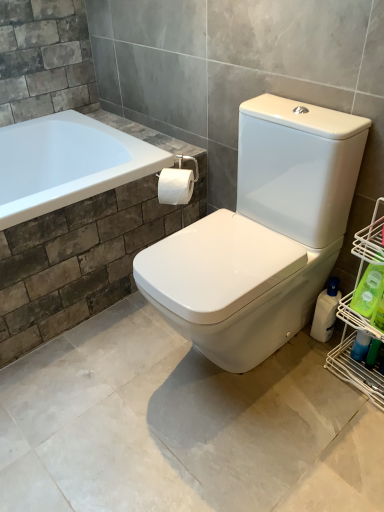
Question: Is blue glossy spray bottle at lower right, which is the second cleaning product from back to front, shorter than white matte toilet paper at center?

Choices:
 (A) yes
 (B) no

Answer: (B)

Question: From a real-world perspective, is blue glossy spray bottle at lower right, the second cleaning product in the front-to-back sequence, over white matte toilet paper at center?

Choices:
 (A) no
 (B) yes

Answer: (A)

Question: Is blue glossy spray bottle at lower right, which is the second cleaning product from back to front, touching white matte toilet paper at center?

Choices:
 (A) no
 (B) yes

Answer: (A)

Question: Does blue glossy spray bottle at lower right, the second cleaning product in the front-to-back sequence, lie in front of white matte toilet paper at center?

Choices:
 (A) yes
 (B) no

Answer: (A)

Question: Is blue glossy spray bottle at lower right, which is the second cleaning product from back to front, at the left side of white matte toilet paper at center?

Choices:
 (A) yes
 (B) no

Answer: (B)

Question: From their relative heights in the image, would you say green plastic bottle at lower right, which is counted as the third cleaning product, starting from the back, is taller or shorter than white matte toilet paper at center?

Choices:
 (A) short
 (B) tall

Answer: (B)

Question: From the image's perspective, is green plastic bottle at lower right, acting as the first cleaning product starting from the front, positioned above or below white matte toilet paper at center?

Choices:
 (A) above
 (B) below

Answer: (B)

Question: Based on their positions, is green plastic bottle at lower right, acting as the first cleaning product starting from the front, located to the left or right of white matte toilet paper at center?

Choices:
 (A) right
 (B) left

Answer: (A)

Question: Considering the positions of green plastic bottle at lower right, acting as the first cleaning product starting from the front, and white matte toilet paper at center in the image, is green plastic bottle at lower right, acting as the first cleaning product starting from the front, wider or thinner than white matte toilet paper at center?

Choices:
 (A) thin
 (B) wide

Answer: (A)

Question: Is point (167, 187) closer or farther from the camera than point (367, 271)?

Choices:
 (A) closer
 (B) farther

Answer: (B)

Question: In the image, is white matte toilet paper at center positioned in front of or behind green plastic bottle at lower right, acting as the first cleaning product starting from the front?

Choices:
 (A) behind
 (B) front

Answer: (A)

Question: Is white matte toilet paper at center inside or outside of green plastic bottle at lower right, which is counted as the third cleaning product, starting from the back?

Choices:
 (A) inside
 (B) outside

Answer: (B)

Question: Would you say white matte toilet paper at center is to the left or to the right of green plastic bottle at lower right, which is counted as the third cleaning product, starting from the back, in the picture?

Choices:
 (A) left
 (B) right

Answer: (A)

Question: In terms of width, does green plastic bottle at lower right, acting as the first cleaning product starting from the front, look wider or thinner when compared to blue glossy spray bottle at lower right, the second cleaning product in the front-to-back sequence?

Choices:
 (A) wide
 (B) thin

Answer: (A)

Question: From the image's perspective, relative to blue glossy spray bottle at lower right, which is the second cleaning product from back to front, is green plastic bottle at lower right, acting as the first cleaning product starting from the front, above or below?

Choices:
 (A) below
 (B) above

Answer: (B)